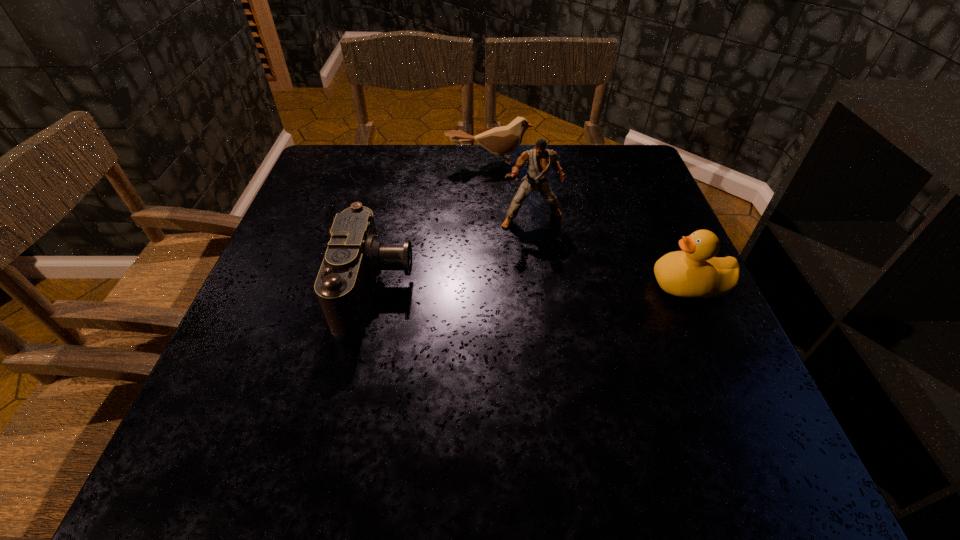
Locate an element on the screen. vacant position at the right edge of the desktop is located at coordinates (631, 198).

Find the location of `vacant position at the far left corner of the desktop`. vacant position at the far left corner of the desktop is located at coordinates (364, 171).

In the image, there is a desktop. Where is `free space at the near left corner`? The height and width of the screenshot is (540, 960). free space at the near left corner is located at coordinates (206, 394).

The image size is (960, 540). I want to click on vacant space at the far right corner of the desktop, so click(x=632, y=179).

Find the location of `free region at the near right corner of the desktop`. free region at the near right corner of the desktop is located at coordinates (706, 404).

In order to click on vacant point located between the puncher and the farthest object in this screenshot , I will do [x=512, y=191].

Where is `free space between the puncher and the leftmost object`? Image resolution: width=960 pixels, height=540 pixels. free space between the puncher and the leftmost object is located at coordinates (454, 253).

In order to click on vacant space that is in between the rightmost object and the bird in this screenshot , I will do `click(590, 224)`.

Where is `vacant area that lies between the camera and the rightmost object`? This screenshot has width=960, height=540. vacant area that lies between the camera and the rightmost object is located at coordinates (533, 286).

Where is `vacant region between the farthest object and the tallest object`? vacant region between the farthest object and the tallest object is located at coordinates (512, 191).